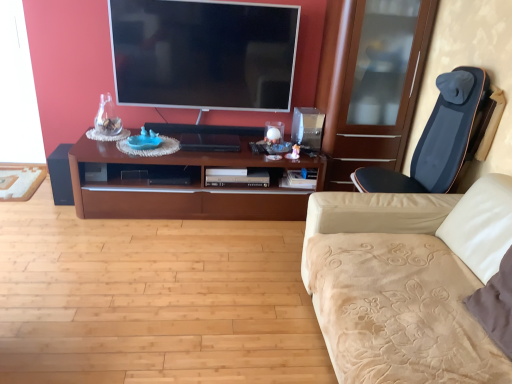
Question: Does flat screen tv at upper center touch black matte speaker at left?

Choices:
 (A) no
 (B) yes

Answer: (A)

Question: Is flat screen tv at upper center taller than black matte speaker at left?

Choices:
 (A) yes
 (B) no

Answer: (A)

Question: Is flat screen tv at upper center smaller than black matte speaker at left?

Choices:
 (A) yes
 (B) no

Answer: (B)

Question: From the image's perspective, is flat screen tv at upper center located above black matte speaker at left?

Choices:
 (A) yes
 (B) no

Answer: (A)

Question: Does flat screen tv at upper center have a larger size compared to black matte speaker at left?

Choices:
 (A) yes
 (B) no

Answer: (A)

Question: Is flat screen tv at upper center not near black matte speaker at left?

Choices:
 (A) yes
 (B) no

Answer: (A)

Question: Can you confirm if beige velvety studio couch at right is smaller than flat screen tv at upper center?

Choices:
 (A) no
 (B) yes

Answer: (A)

Question: Is beige velvety studio couch at right to the right of flat screen tv at upper center from the viewer's perspective?

Choices:
 (A) yes
 (B) no

Answer: (A)

Question: Can you confirm if beige velvety studio couch at right is taller than flat screen tv at upper center?

Choices:
 (A) no
 (B) yes

Answer: (B)

Question: Is the depth of beige velvety studio couch at right less than that of flat screen tv at upper center?

Choices:
 (A) yes
 (B) no

Answer: (A)

Question: Considering the relative sizes of beige velvety studio couch at right and flat screen tv at upper center in the image provided, is beige velvety studio couch at right thinner than flat screen tv at upper center?

Choices:
 (A) no
 (B) yes

Answer: (A)

Question: From the image's perspective, is beige velvety studio couch at right below flat screen tv at upper center?

Choices:
 (A) yes
 (B) no

Answer: (A)

Question: From a real-world perspective, is black matte speaker at left located beneath dark blue fabric massage chair at right?

Choices:
 (A) no
 (B) yes

Answer: (B)